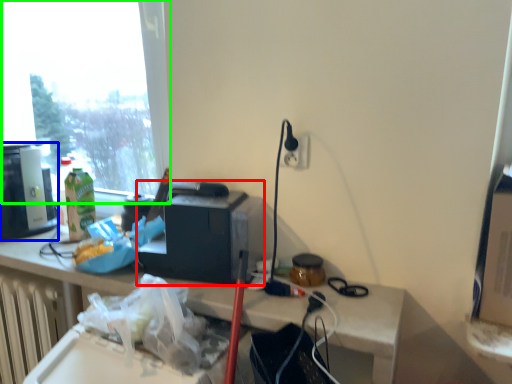
Question: Which object is positioned farthest from appliance (highlighted by a red box)? Select from coffee machine (highlighted by a blue box) and window (highlighted by a green box).

Choices:
 (A) coffee machine
 (B) window

Answer: (B)